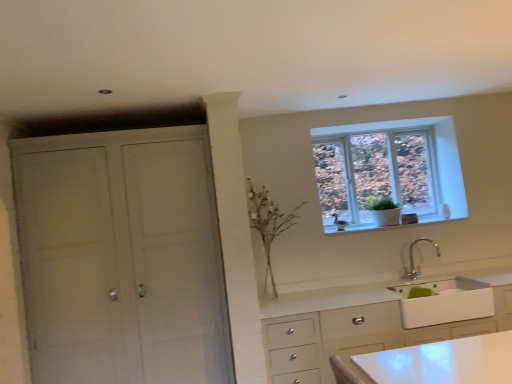
Question: Is white glossy sink at lower right with silver metallic faucet at lower center?

Choices:
 (A) no
 (B) yes

Answer: (A)

Question: Is white glossy sink at lower right behind silver metallic faucet at lower center?

Choices:
 (A) yes
 (B) no

Answer: (B)

Question: From a real-world perspective, is white glossy sink at lower right under silver metallic faucet at lower center?

Choices:
 (A) no
 (B) yes

Answer: (B)

Question: From the image's perspective, is white glossy sink at lower right beneath silver metallic faucet at lower center?

Choices:
 (A) no
 (B) yes

Answer: (B)

Question: Does white glossy sink at lower right come in front of silver metallic faucet at lower center?

Choices:
 (A) yes
 (B) no

Answer: (A)

Question: Is white glossy sink at lower right at the left side of silver metallic faucet at lower center?

Choices:
 (A) yes
 (B) no

Answer: (B)

Question: Is silver metallic faucet at lower center next to clear glass window at upper right and touching it?

Choices:
 (A) yes
 (B) no

Answer: (B)

Question: Considering the relative positions of silver metallic faucet at lower center and clear glass window at upper right in the image provided, is silver metallic faucet at lower center in front of clear glass window at upper right?

Choices:
 (A) no
 (B) yes

Answer: (B)

Question: Is silver metallic faucet at lower center positioned behind clear glass window at upper right?

Choices:
 (A) yes
 (B) no

Answer: (B)

Question: Considering the relative sizes of silver metallic faucet at lower center and clear glass window at upper right in the image provided, is silver metallic faucet at lower center thinner than clear glass window at upper right?

Choices:
 (A) yes
 (B) no

Answer: (B)

Question: Is silver metallic faucet at lower center completely or partially outside of clear glass window at upper right?

Choices:
 (A) no
 (B) yes

Answer: (B)

Question: Can you confirm if silver metallic faucet at lower center is positioned to the left of clear glass window at upper right?

Choices:
 (A) no
 (B) yes

Answer: (A)

Question: Is clear glass window at upper right oriented towards white ceramic window sill at upper right?

Choices:
 (A) no
 (B) yes

Answer: (B)